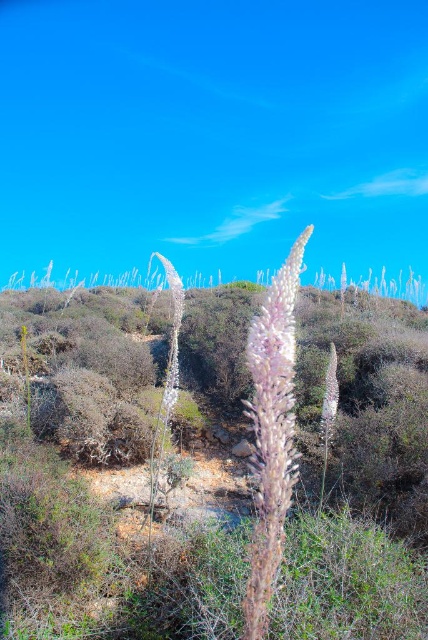
Question: Which object is farther from the camera taking this photo?

Choices:
 (A) fuzzy pink flower at center
 (B) white fuzzy plant at center

Answer: (B)

Question: Does fuzzy pink flower at center appear on the left side of white fuzzy plant at center?

Choices:
 (A) no
 (B) yes

Answer: (B)

Question: Can you confirm if fuzzy pink flower at center is positioned below white fuzzy plant at center?

Choices:
 (A) yes
 (B) no

Answer: (B)

Question: Can you confirm if fuzzy pink flower at center is positioned to the right of white fuzzy plant at center?

Choices:
 (A) no
 (B) yes

Answer: (A)

Question: Which point is closer to the camera?

Choices:
 (A) fuzzy pink flower at center
 (B) white fuzzy plant at center

Answer: (A)